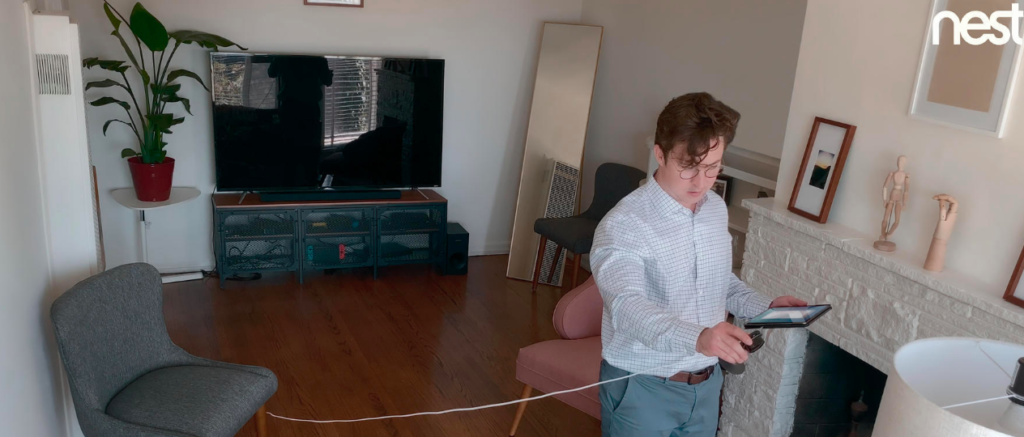
This screenshot has height=437, width=1024. I want to click on television stand, so click(x=327, y=232).